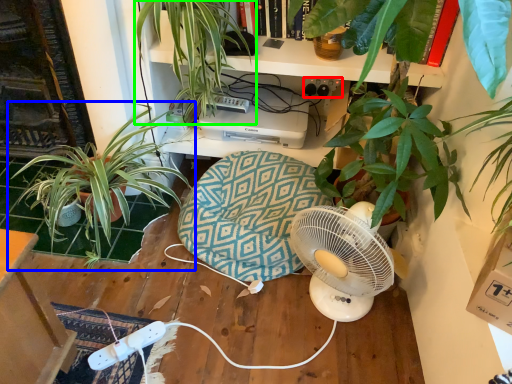
Question: Estimate the real-world distances between objects in this image. Which object is closer to plug (highlighted by a red box), houseplant (highlighted by a blue box) or houseplant (highlighted by a green box)?

Choices:
 (A) houseplant
 (B) houseplant

Answer: (B)